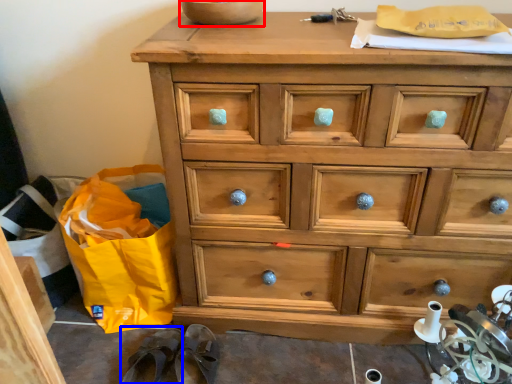
Question: Which object appears farthest to the camera in this image, bowl (highlighted by a red box) or slipper (highlighted by a blue box)?

Choices:
 (A) bowl
 (B) slipper

Answer: (B)